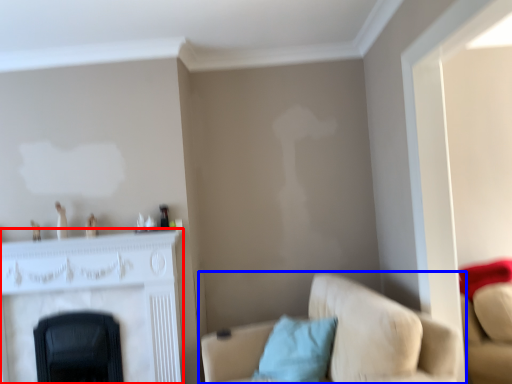
Question: Which object is closer to the camera taking this photo, fireplace (highlighted by a red box) or studio couch (highlighted by a blue box)?

Choices:
 (A) fireplace
 (B) studio couch

Answer: (B)